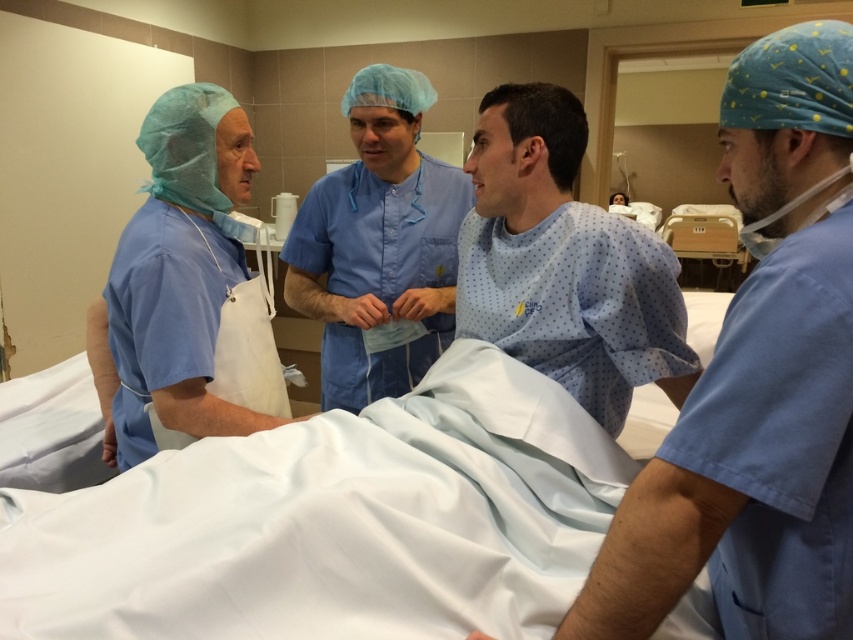
Is blue scrubs at left closer to the viewer compared to light blue fabric at center?

No, it is not.

Does point (114, 426) lie behind point (498, 296)?

Yes, it is behind point (498, 296).

What are the coordinates of `blue scrubs at left` in the screenshot? It's located at (187, 291).

This screenshot has width=853, height=640. In order to click on blue scrubs at center in this screenshot , I will do `click(758, 387)`.

Based on the photo, does blue scrubs at center have a lesser height compared to blue scrubs at left?

Yes.

Does point (825, 376) come behind point (157, 145)?

No, (825, 376) is closer to viewer.

Locate an element on the screen. blue scrubs at center is located at coordinates (758, 387).